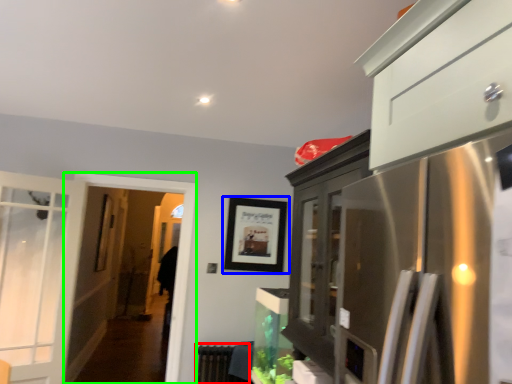
Question: Which is nearer to the radiator (highlighted by a red box)? picture frame (highlighted by a blue box) or screen door (highlighted by a green box).

Choices:
 (A) picture frame
 (B) screen door

Answer: (B)